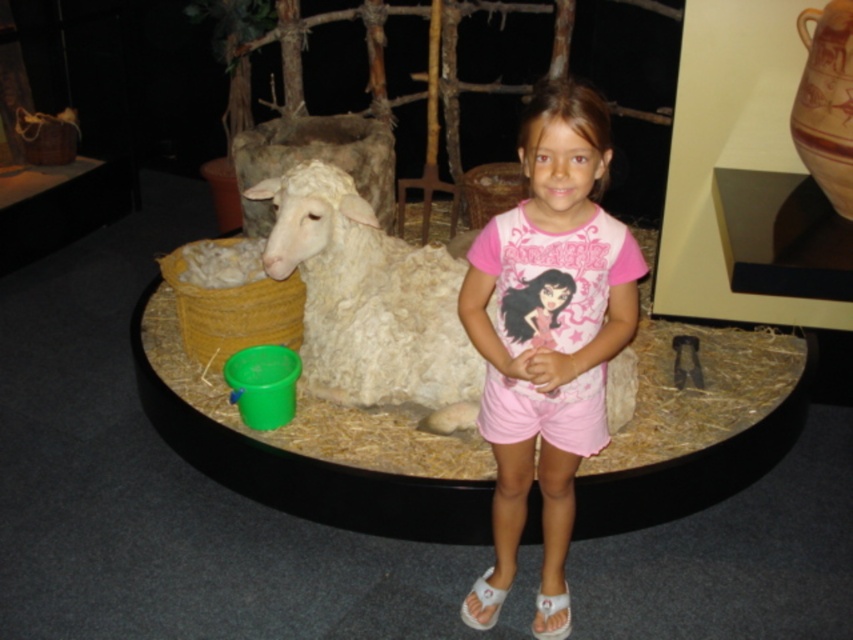
The young girl is standing in front of a museum exhibit. She is wearing the pink cotton shorts at center and standing next to the white woolen sheep at center. Which clothing item is on the right side when viewed from the front?

The pink cotton shorts at center is positioned on the right side of the white woolen sheep at center.

Looking at this image, you are a museum guide standing at the entrance of the exhibit. A visitor asks if they can approach the display to take a closer look at the pink cotton shorts at center. The museum has a safety rule that visitors must stay at least 1.5 meters away from all exhibits. Can the visitor safely approach the display without violating the rule?

The pink cotton shorts at center are currently 1.68 meters away from the viewer. Since the required safety distance is 1.5 meters, the visitor can approach closer to within 1.5 meters and still comply with the rule.

The young girl is standing in front of a museum exhibit featuring a life sized sheep model. She is wearing pink cotton shorts at center and notices the white woolen sheep at center. Which object is closer to the ground?

The pink cotton shorts at center is positioned under the white woolen sheep at center, meaning it is closer to the ground.